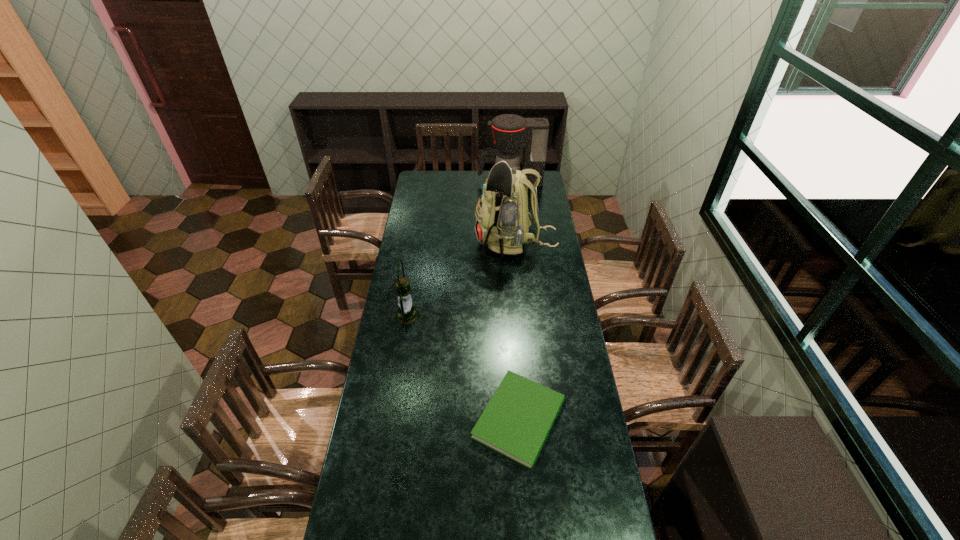
Identify the location of vacant space located on the front-facing side of the backpack. The width and height of the screenshot is (960, 540). (419, 243).

The height and width of the screenshot is (540, 960). Identify the location of vacant space positioned 0.240m pour from the carafe of the third shortest object. (440, 182).

Where is `blank area located pour from the carafe of the third shortest object`? This screenshot has width=960, height=540. blank area located pour from the carafe of the third shortest object is located at coordinates (425, 182).

Where is `vacant space located pour from the carafe of the third shortest object`? vacant space located pour from the carafe of the third shortest object is located at coordinates (469, 182).

Identify the location of vacant space positioned on the side where the third tallest object emits light. (489, 316).

Identify the location of free space located 0.170m on the back of the paperback book. (514, 341).

Find the location of a particular element. object present at the far edge is located at coordinates (510, 132).

Find the location of a particular element. This screenshot has height=540, width=960. object that is at the left edge is located at coordinates (407, 314).

Identify the location of backpack that is at the right edge. The width and height of the screenshot is (960, 540). (502, 222).

I want to click on coffee maker that is at the right edge, so click(510, 132).